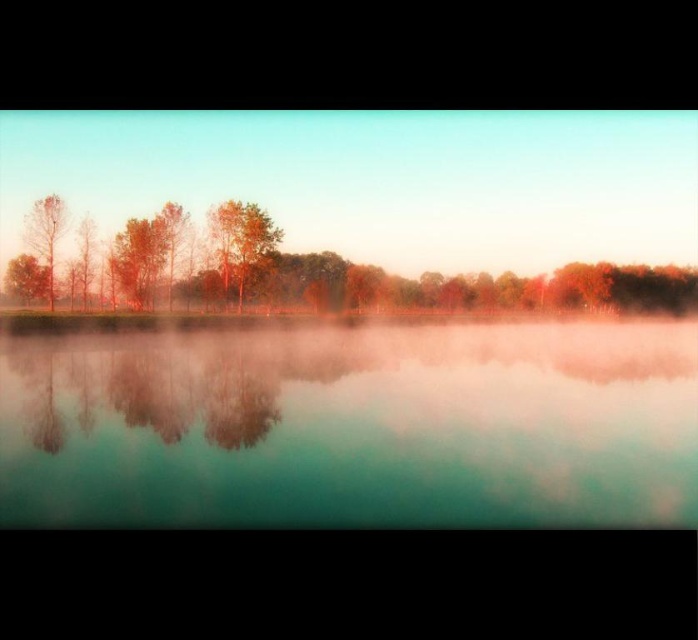
Does point (126, 264) come closer to viewer compared to point (50, 237)?

No, (126, 264) is further to viewer.

Does matte orange trees at center have a lesser height compared to smooth brown tree at left?

Incorrect, matte orange trees at center's height does not fall short of smooth brown tree at left's.

Where is `matte orange trees at center`? matte orange trees at center is located at coordinates (299, 273).

Does translucent glass water at center appear on the right side of matte orange trees at center?

In fact, translucent glass water at center is to the left of matte orange trees at center.

Between point (399, 378) and point (140, 237), which one is positioned behind?

The point (140, 237) is more distant.

Describe the element at coordinates (355, 426) in the screenshot. The width and height of the screenshot is (698, 640). I see `translucent glass water at center` at that location.

Image resolution: width=698 pixels, height=640 pixels. What are the coordinates of `translucent glass water at center` in the screenshot? It's located at (355, 426).

Measure the distance between orange-brown textured tree at center and camera.

orange-brown textured tree at center and camera are 72.18 meters apart from each other.

Describe the element at coordinates (239, 241) in the screenshot. I see `orange-brown textured tree at center` at that location.

Identify the location of orange-brown textured tree at center. This screenshot has width=698, height=640. (239, 241).